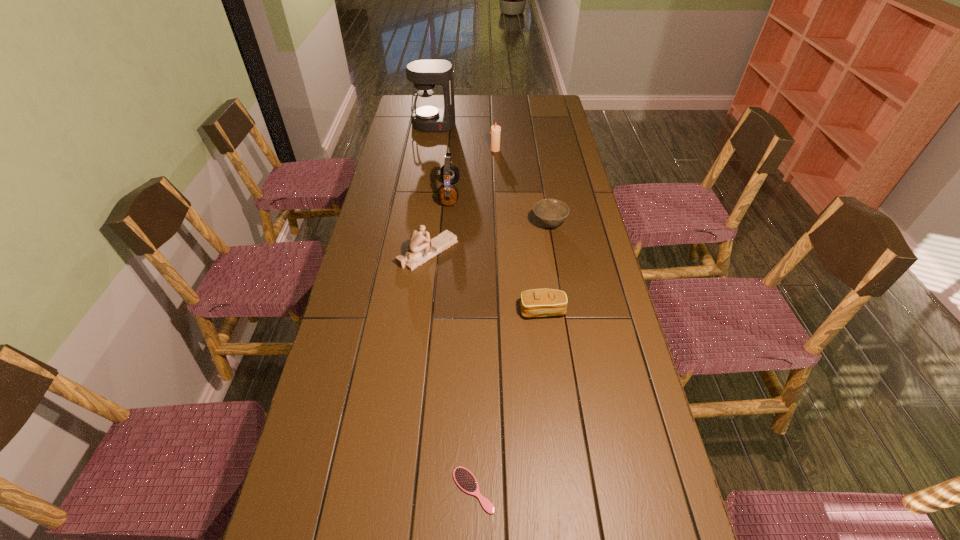
Identify the location of the tallest object. This screenshot has width=960, height=540. (424, 74).

You are a GUI agent. You are given a task and a screenshot of the screen. Output one action in this format:
    pyautogui.click(x=<x>, y=<y>)
    Task: Click on the farthest object
    This screenshot has width=960, height=540.
    Given the screenshot: What is the action you would take?
    pyautogui.click(x=424, y=74)

Where is `headset`? headset is located at coordinates (447, 193).

Locate an element on the screen. The height and width of the screenshot is (540, 960). the sixth shortest object is located at coordinates tap(447, 193).

In order to click on the sixth nearest object in this screenshot , I will do `click(495, 129)`.

Locate an element on the screen. The width and height of the screenshot is (960, 540). candle is located at coordinates (495, 129).

The height and width of the screenshot is (540, 960). I want to click on figurine, so click(x=421, y=249).

You are a GUI agent. You are given a task and a screenshot of the screen. Output one action in this format:
    pyautogui.click(x=<x>, y=<y>)
    Task: Click on the bowl
    
    Given the screenshot: What is the action you would take?
    pyautogui.click(x=550, y=213)

The height and width of the screenshot is (540, 960). Find the location of `clutch bag`. clutch bag is located at coordinates (538, 302).

Identify the location of the fourth object from right to left. Image resolution: width=960 pixels, height=540 pixels. (465, 480).